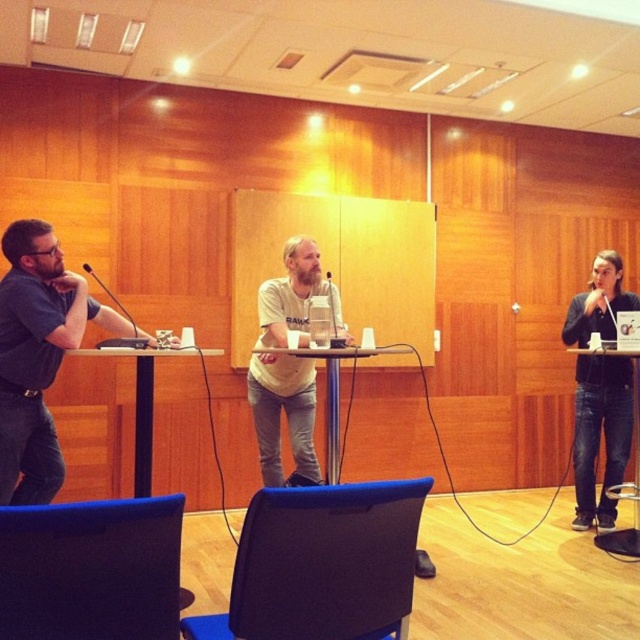
Which is below, blue fabric chair at lower center or white plastic table at center?

Positioned lower is blue fabric chair at lower center.

Locate an element on the screen. This screenshot has width=640, height=640. blue fabric chair at lower center is located at coordinates (321, 564).

At what (x,y) coordinates should I click in order to perform the action: click on blue fabric chair at lower center. Please return your answer as a coordinate pair (x, y). The image size is (640, 640). Looking at the image, I should click on (321, 564).

Is blue fabric chair at lower center closer to the viewer compared to matte gray shirt at left?

Yes, blue fabric chair at lower center is in front of matte gray shirt at left.

Identify the location of blue fabric chair at lower center. (321, 564).

Locate an element on the screen. The width and height of the screenshot is (640, 640). blue fabric chair at lower center is located at coordinates (321, 564).

Is black matte microphone at center below brushed metal microphone at center?

Indeed, black matte microphone at center is positioned under brushed metal microphone at center.

Which is behind, point (88, 264) or point (330, 280)?

The point (330, 280) is behind.

Who is more distant from viewer, (90,269) or (330,278)?

Positioned behind is point (330,278).

Where is `black matte microphone at center`? The image size is (640, 640). black matte microphone at center is located at coordinates (88, 268).